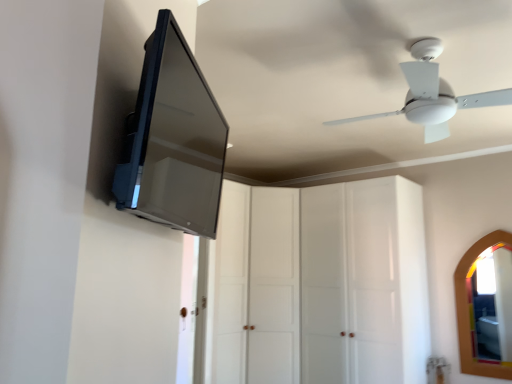
Question: Is satin black tv at upper left completely or partially outside of transparent glass cabinet at center, which is counted as the first glass door, starting from the left?

Choices:
 (A) yes
 (B) no

Answer: (A)

Question: Is satin black tv at upper left facing towards transparent glass cabinet at center, arranged as the 2th glass door when viewed from the right?

Choices:
 (A) yes
 (B) no

Answer: (B)

Question: From the image's perspective, is satin black tv at upper left beneath transparent glass cabinet at center, which is counted as the first glass door, starting from the left?

Choices:
 (A) yes
 (B) no

Answer: (B)

Question: Does satin black tv at upper left appear on the right side of transparent glass cabinet at center, which is counted as the first glass door, starting from the left?

Choices:
 (A) yes
 (B) no

Answer: (B)

Question: Is satin black tv at upper left thinner than transparent glass cabinet at center, arranged as the 2th glass door when viewed from the right?

Choices:
 (A) no
 (B) yes

Answer: (B)

Question: Choose the correct answer: Is transparent glass cabinet at center, arranged as the 2th glass door when viewed from the right, inside wooden-framed mirror at right or outside it?

Choices:
 (A) inside
 (B) outside

Answer: (B)

Question: In terms of size, does transparent glass cabinet at center, which is counted as the first glass door, starting from the left, appear bigger or smaller than wooden-framed mirror at right?

Choices:
 (A) small
 (B) big

Answer: (B)

Question: In the image, is transparent glass cabinet at center, which is counted as the first glass door, starting from the left, positioned in front of or behind wooden-framed mirror at right?

Choices:
 (A) behind
 (B) front

Answer: (B)

Question: Considering the positions of transparent glass cabinet at center, which is counted as the first glass door, starting from the left, and wooden-framed mirror at right in the image, is transparent glass cabinet at center, which is counted as the first glass door, starting from the left, taller or shorter than wooden-framed mirror at right?

Choices:
 (A) tall
 (B) short

Answer: (A)

Question: Considering their positions, is wooden-framed mirror at right located in front of or behind white plastic ceiling fan at upper right?

Choices:
 (A) front
 (B) behind

Answer: (B)

Question: Is wooden-framed mirror at right wider or thinner than white plastic ceiling fan at upper right?

Choices:
 (A) thin
 (B) wide

Answer: (A)

Question: Considering the relative positions of wooden-framed mirror at right and white plastic ceiling fan at upper right in the image provided, is wooden-framed mirror at right to the left or to the right of white plastic ceiling fan at upper right?

Choices:
 (A) left
 (B) right

Answer: (B)

Question: Is wooden-framed mirror at right inside or outside of white plastic ceiling fan at upper right?

Choices:
 (A) inside
 (B) outside

Answer: (B)

Question: From a real-world perspective, relative to transparent glass cabinet at center, which is counted as the first glass door, starting from the left, is white plastic ceiling fan at upper right vertically above or below?

Choices:
 (A) above
 (B) below

Answer: (A)

Question: Is white plastic ceiling fan at upper right taller or shorter than transparent glass cabinet at center, arranged as the 2th glass door when viewed from the right?

Choices:
 (A) short
 (B) tall

Answer: (A)